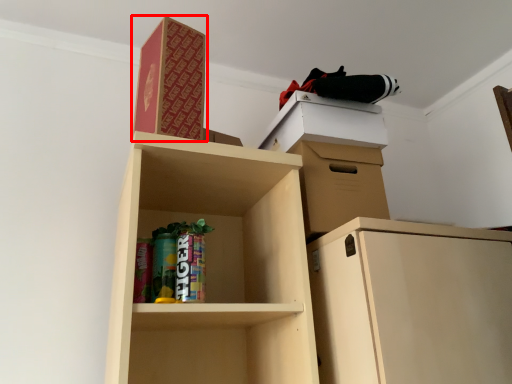
Question: From the image's perspective, considering the relative positions of paperback book (annotated by the red box) and cabinetry in the image provided, where is paperback book (annotated by the red box) located with respect to the staircase?

Choices:
 (A) above
 (B) below

Answer: (A)